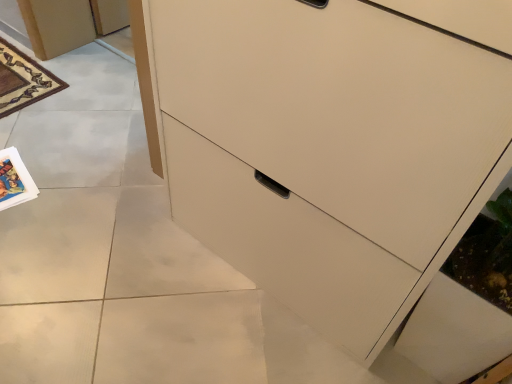
The image size is (512, 384). What are the coordinates of `matte paper magazine at lower left` in the screenshot? It's located at (14, 180).

Image resolution: width=512 pixels, height=384 pixels. Describe the element at coordinates (14, 180) in the screenshot. I see `matte paper magazine at lower left` at that location.

I want to click on matte paper magazine at lower left, so click(x=14, y=180).